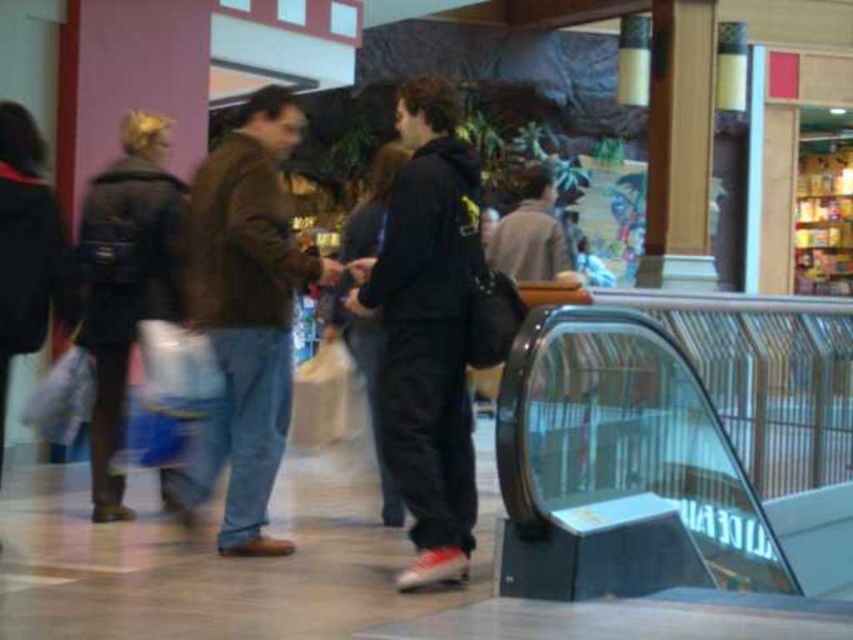
You are a security guard in the mall and need to identify the height of two shoppers. You see the dark gray hoodie at center and the brown leather jacket at left. Which person is taller?

The dark gray hoodie at center is shorter than brown leather jacket at left, so the person in the brown leather jacket at left is taller.

You are standing at the point labeled as point (x=426, y=330) in the mall. Looking around, you see a dark gray hoodie at center. What is the nearest object to your current position?

The nearest object to point (x=426, y=330) is the dark gray hoodie at center as the point corresponds to it.

You are standing at the bottom of the curved escalator on the right. You see a dark gray hoodie at center and a brown leather jacket at left. Which person is closer to your current position?

The dark gray hoodie at center is closer to your current position because it is positioned to the right of the brown leather jacket at left, and since you are at the right side of the escalator, the person to the right would be nearer.